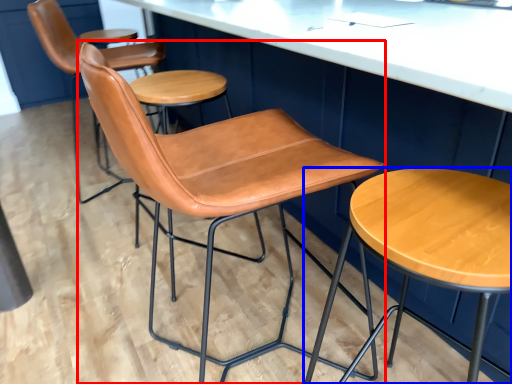
Question: Which point is further to the camera, chair (highlighted by a red box) or stool (highlighted by a blue box)?

Choices:
 (A) chair
 (B) stool

Answer: (A)